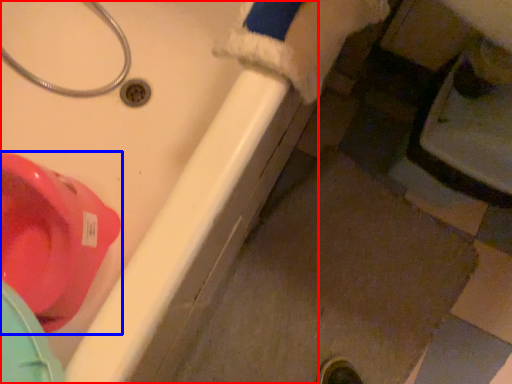
Question: Among these objects, which one is farthest to the camera, bath (highlighted by a red box) or toilet (highlighted by a blue box)?

Choices:
 (A) bath
 (B) toilet

Answer: (B)